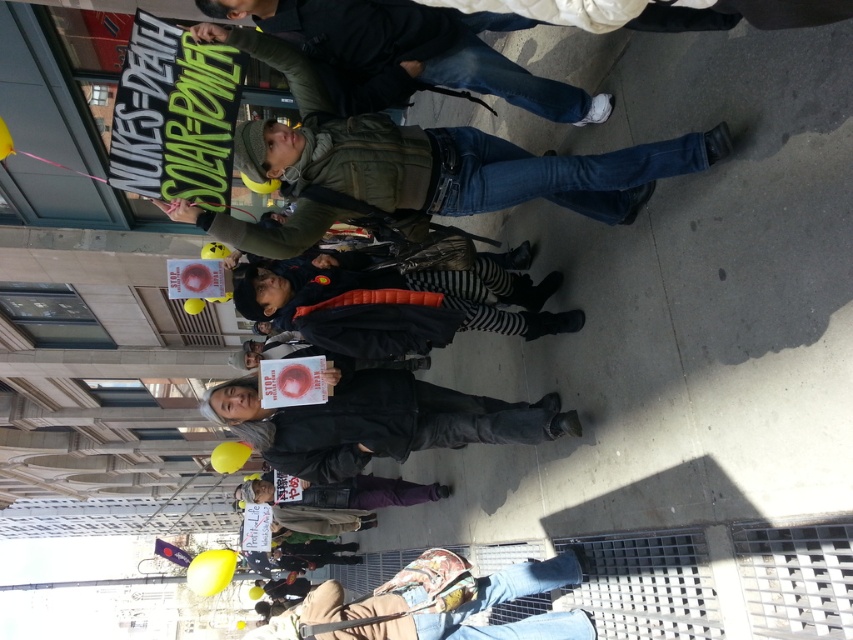
Which is above, denim jeans at upper center or gray fabric jacket at center?

denim jeans at upper center is higher up.

Looking at this image, is denim jeans at upper center shorter than gray fabric jacket at center?

Yes, denim jeans at upper center is shorter than gray fabric jacket at center.

At what (x,y) coordinates should I click in order to perform the action: click on denim jeans at upper center. Please return your answer as a coordinate pair (x, y). The height and width of the screenshot is (640, 853). Looking at the image, I should click on (410, 52).

This screenshot has height=640, width=853. I want to click on denim jeans at upper center, so tap(410, 52).

Based on the photo, who is more forward, (453,429) or (518,564)?

Positioned in front is point (518,564).

Who is lower down, gray fabric jacket at center or denim jeans at lower center?

Positioned lower is denim jeans at lower center.

You are a GUI agent. You are given a task and a screenshot of the screen. Output one action in this format:
    pyautogui.click(x=<x>, y=<y>)
    Task: Click on the gray fabric jacket at center
    The height and width of the screenshot is (640, 853).
    Given the screenshot: What is the action you would take?
    pyautogui.click(x=376, y=420)

Locate an element on the screen. This screenshot has height=640, width=853. gray fabric jacket at center is located at coordinates (376, 420).

Is denim jeans at upper center shorter than denim jeans at lower center?

Yes, denim jeans at upper center is shorter than denim jeans at lower center.

Who is positioned more to the left, denim jeans at upper center or denim jeans at lower center?

Positioned to the left is denim jeans at upper center.

Does point (421, 44) come closer to viewer compared to point (450, 566)?

No, it is behind (450, 566).

In order to click on denim jeans at upper center in this screenshot , I will do `click(410, 52)`.